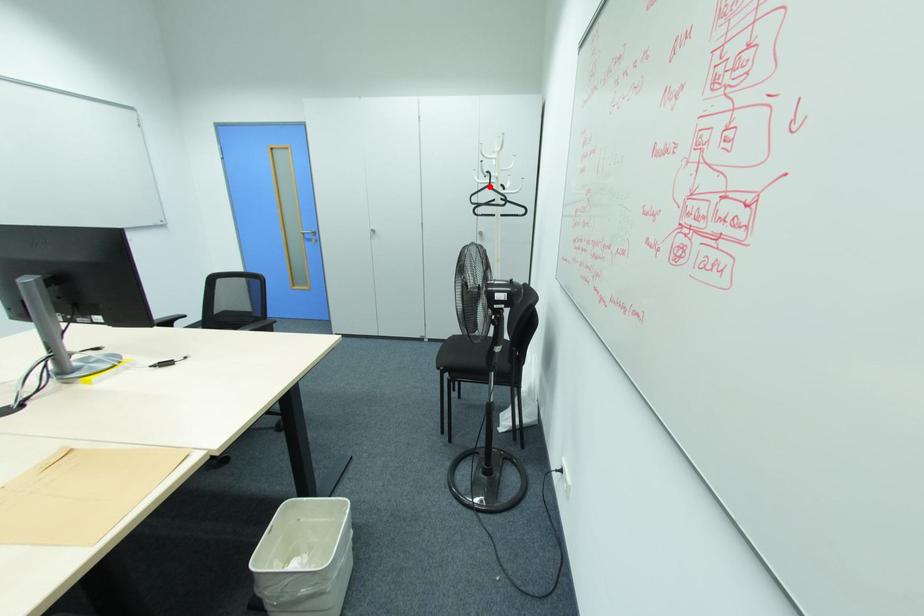
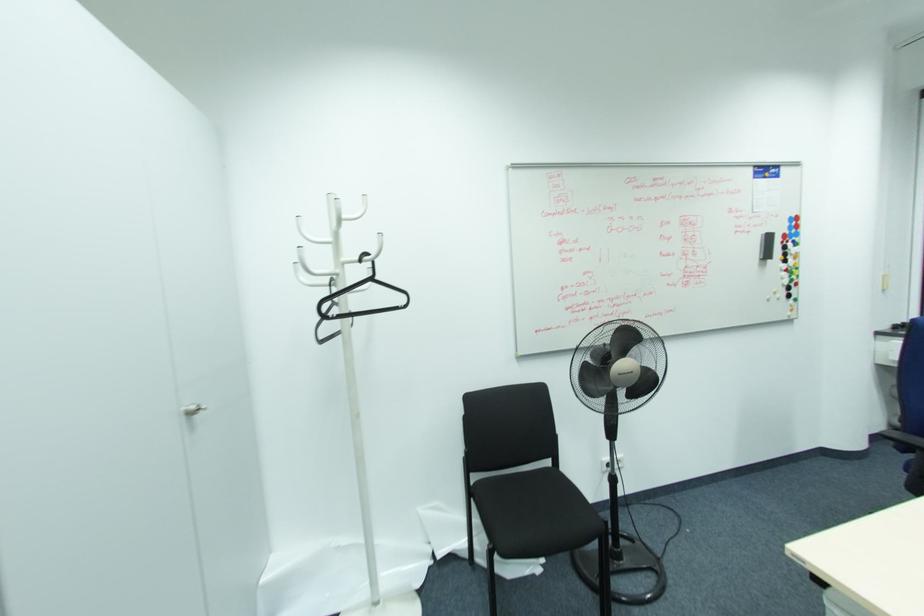
Question: I am providing you with two images of the same scene from different viewpoints. In image1, a red point is highlighted. Considering the same 3D point in image2, which of the following is correct?

Choices:
 (A) It is closer
 (B) It is farther

Answer: (B)